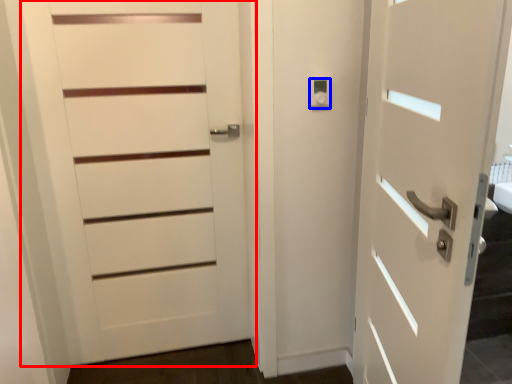
Question: Which of the following is the farthest to the observer, door (highlighted by a red box) or knob (highlighted by a blue box)?

Choices:
 (A) door
 (B) knob

Answer: (B)